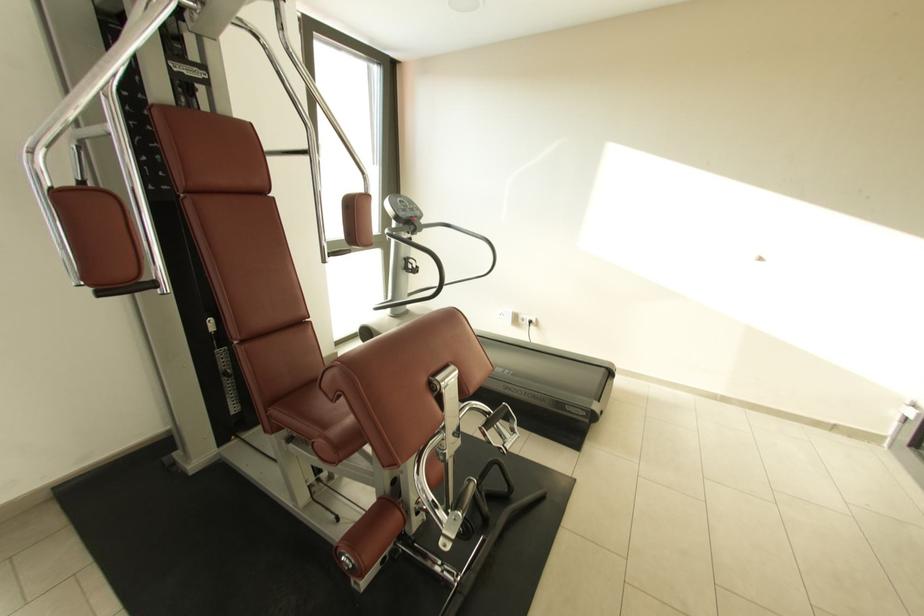
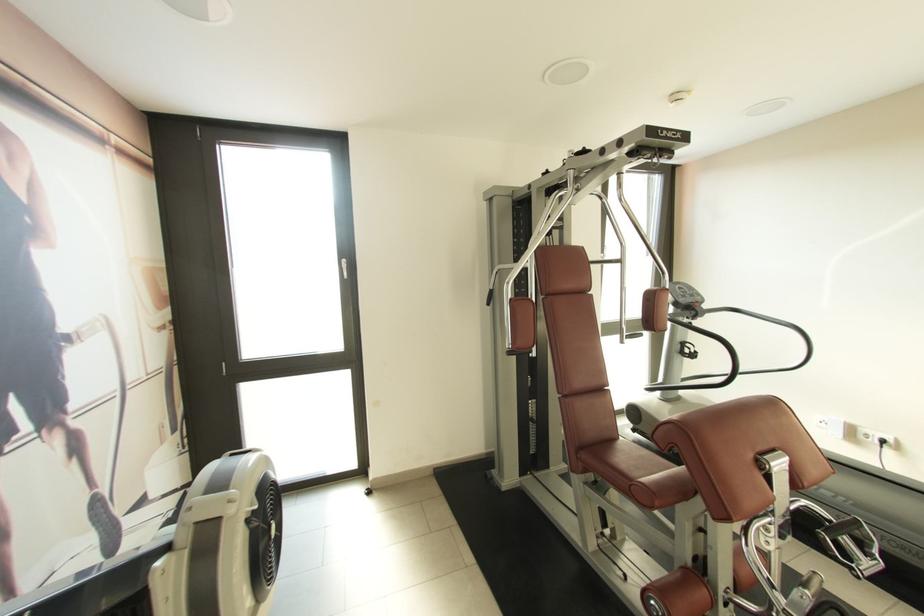
In the second image, find the point that corresponds to [488,429] in the first image.

(829, 535)